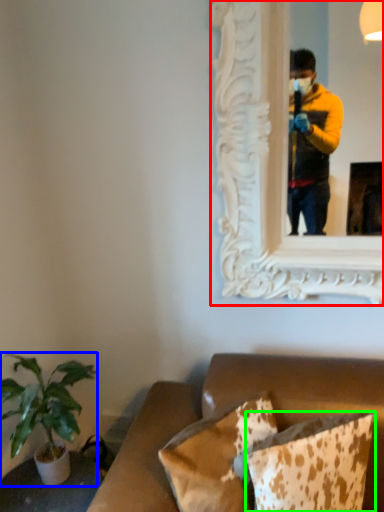
Question: Estimate the real-world distances between objects in this image. Which object is closer to picture frame (highlighted by a red box), houseplant (highlighted by a blue box) or pillow (highlighted by a green box)?

Choices:
 (A) houseplant
 (B) pillow

Answer: (B)